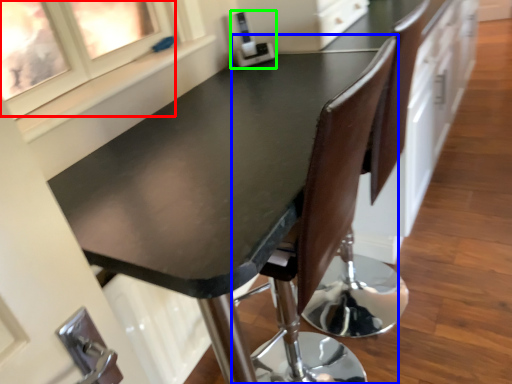
Question: Which object is the farthest from window (highlighted by a red box)? Choose among these: chair (highlighted by a blue box) or appliance (highlighted by a green box).

Choices:
 (A) chair
 (B) appliance

Answer: (A)